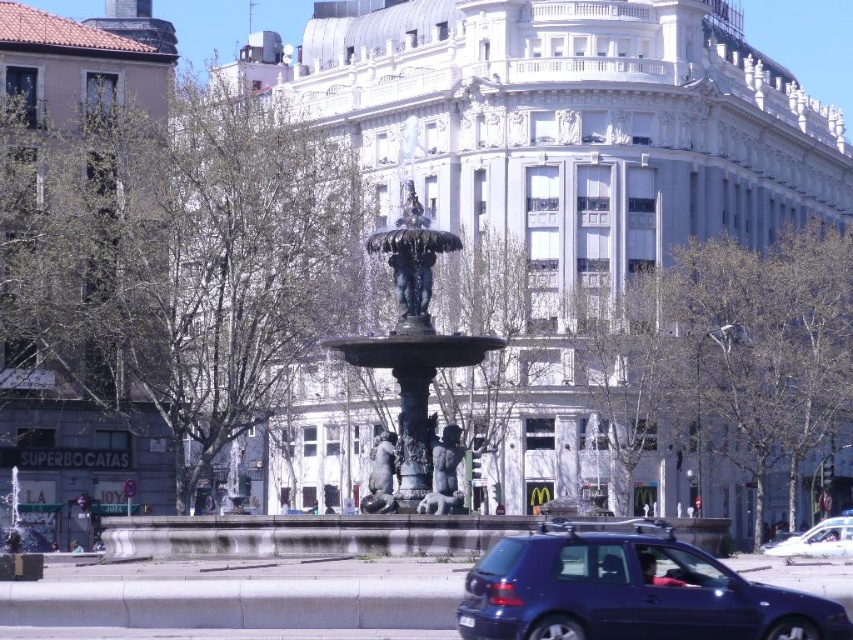
Can you confirm if green leafy tree at upper left is positioned to the right of white glossy car at lower right?

In fact, green leafy tree at upper left is to the left of white glossy car at lower right.

Which is below, green leafy tree at upper left or white glossy car at lower right?

white glossy car at lower right is below.

The width and height of the screenshot is (853, 640). Describe the element at coordinates (180, 259) in the screenshot. I see `green leafy tree at upper left` at that location.

Where is `green leafy tree at upper left`? The image size is (853, 640). green leafy tree at upper left is located at coordinates (180, 259).

Between point (91, 276) and point (787, 605), which one is positioned in front?

Point (787, 605) is in front.

Can you confirm if green leafy tree at upper left is positioned to the right of metallic blue hatchback at lower center?

In fact, green leafy tree at upper left is to the left of metallic blue hatchback at lower center.

Is point (149, 340) positioned behind point (564, 600)?

Yes, point (149, 340) is behind point (564, 600).

You are a GUI agent. You are given a task and a screenshot of the screen. Output one action in this format:
    pyautogui.click(x=<x>, y=<y>)
    Task: Click on the green leafy tree at upper left
    The image size is (853, 640).
    Given the screenshot: What is the action you would take?
    pyautogui.click(x=180, y=259)

Does metallic blue hatchback at lower center have a smaller size compared to green leafy tree at center?

Yes.

Can you confirm if metallic blue hatchback at lower center is positioned to the right of green leafy tree at center?

Yes, metallic blue hatchback at lower center is to the right of green leafy tree at center.

Between point (792, 614) and point (502, 298), which one is positioned behind?

Point (502, 298)

Where is `metallic blue hatchback at lower center`? The width and height of the screenshot is (853, 640). metallic blue hatchback at lower center is located at coordinates (628, 589).